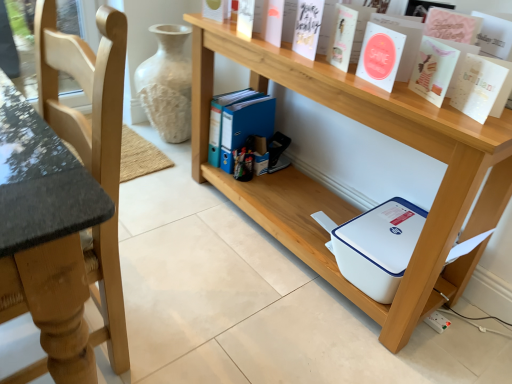
The image size is (512, 384). Identify the location of free space in front of white paper at upper right, which ranks as the first paperback book in right-to-left order. 478,129.